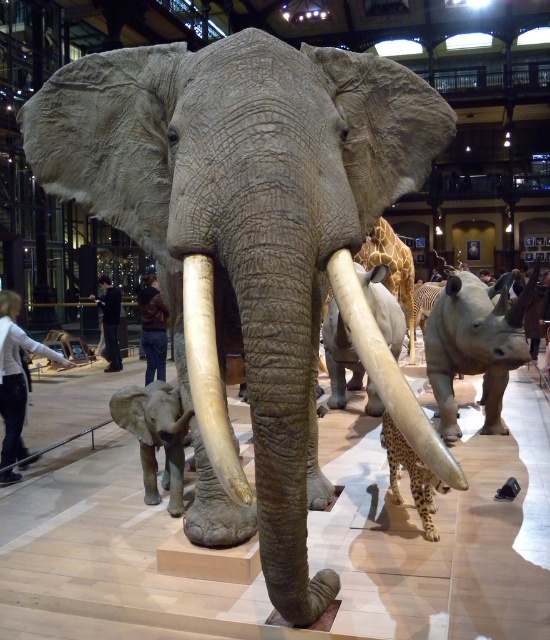
Question: Is matte gray rhinoceros at right bigger than gray matte elephant at lower left?

Choices:
 (A) no
 (B) yes

Answer: (B)

Question: Which point is farther to the camera?

Choices:
 (A) white ivory tusk at center
 (B) matte ivory tusk at center

Answer: (B)

Question: Which of the following is the closest to the observer?

Choices:
 (A) (392, 316)
 (B) (163, 422)
 (C) (415, 448)
 (D) (449, 442)

Answer: (C)

Question: Does matte ivory tusk at center have a lesser width compared to gray matte elephant at lower left?

Choices:
 (A) no
 (B) yes

Answer: (B)

Question: Does matte gray rhinoceros at right appear over white ivory tusk at center?

Choices:
 (A) yes
 (B) no

Answer: (A)

Question: Which point is farther to the camera?

Choices:
 (A) (177, 504)
 (B) (221, 422)
 (C) (382, 385)
 (D) (496, 282)

Answer: (D)